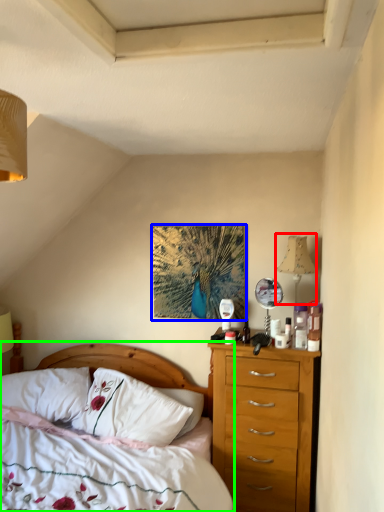
Question: Which object is the farthest from lamp (highlighted by a red box)? Choose among these: picture frame (highlighted by a blue box) or bed (highlighted by a green box).

Choices:
 (A) picture frame
 (B) bed

Answer: (B)